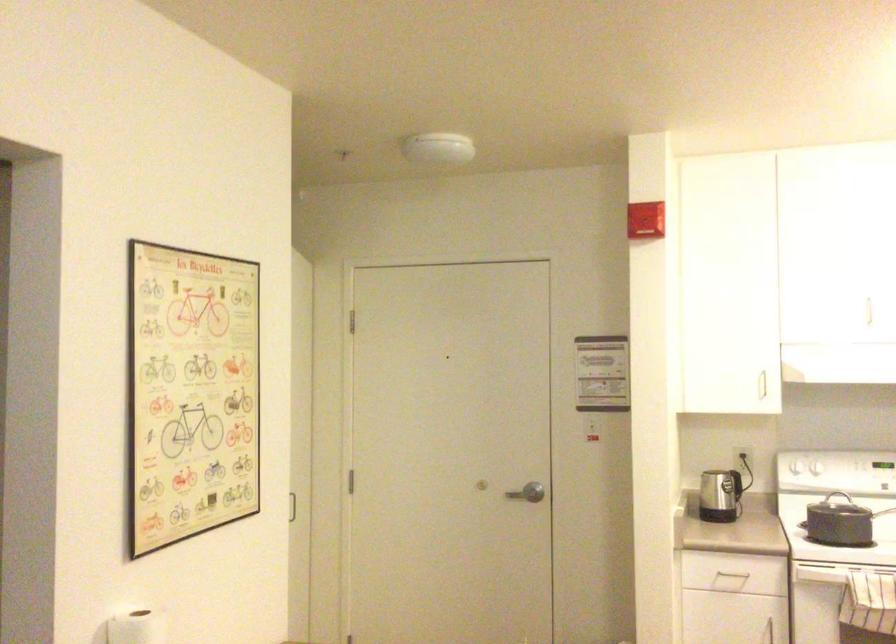
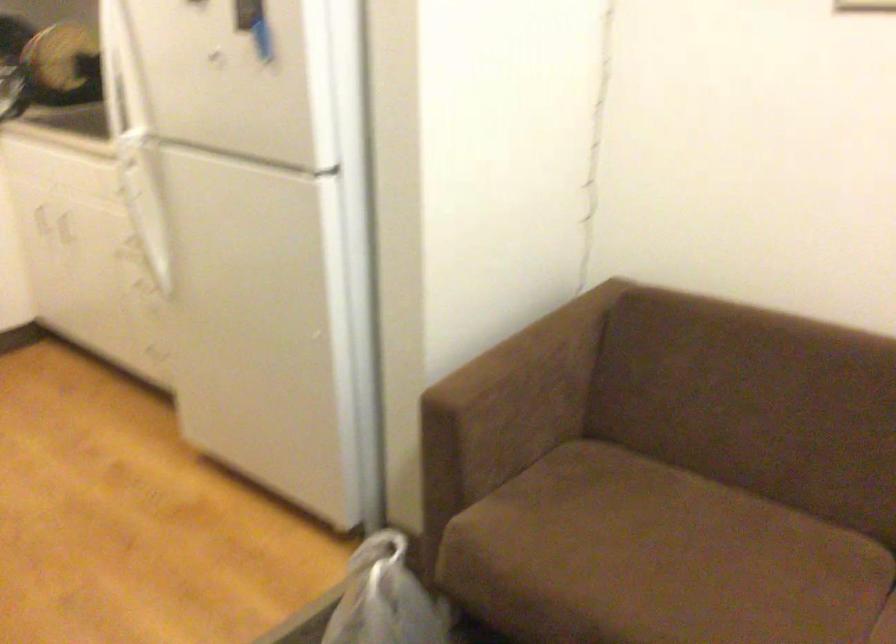
First-person continuous shooting, in which direction is the camera rotating?

The camera rotated toward right-down.